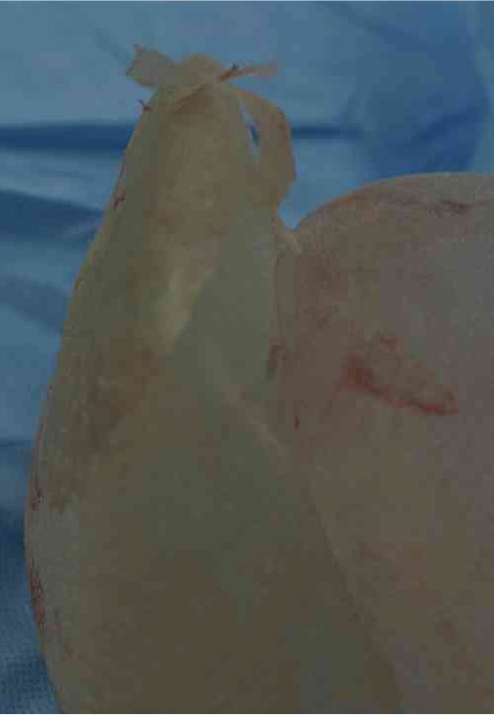
Identify the location of right corner edge. The width and height of the screenshot is (495, 715). (489, 279), (489, 548).